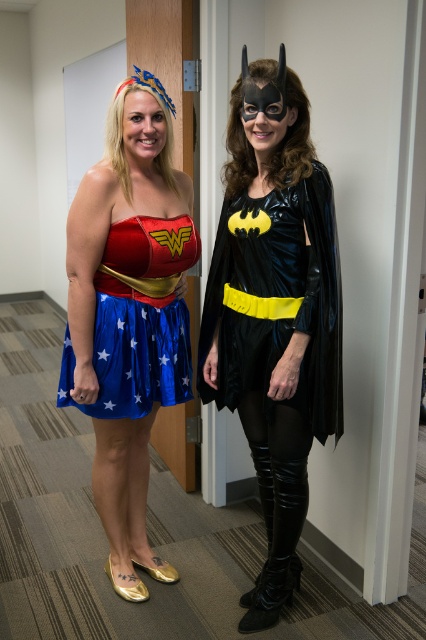
You are a photographer setting up for a photoshoot in an office hallway. You have two props to place in the center of the scene for the superheroes. The shiny black cape at center and the blue shiny dress at center. The cape is larger than the dress. You need to ensure that the props do not overlap. Which prop should you place first to avoid overlapping?

The shiny black cape at center is bigger than the blue shiny dress at center, so you should place the shiny black cape at center first to ensure there is enough space for both props without overlapping.

You are a photographer trying to capture a clear photo of both the shiny blue skirt at center and the shiny black cape at center. Which object will appear larger in your photo?

The shiny blue skirt at center will appear larger in the photo because it is closer to the viewer than the shiny black cape at center.

You are a photographer setting up for a superhero costume photoshoot in an office hallway. You need to ensure the shiny black cape at center and the blue shiny dress at center are both visible in the frame. Based on their positions, which object is covering part of the other?

The shiny black cape at center is positioned over the blue shiny dress at center, so it is covering part of the blue shiny dress at center.